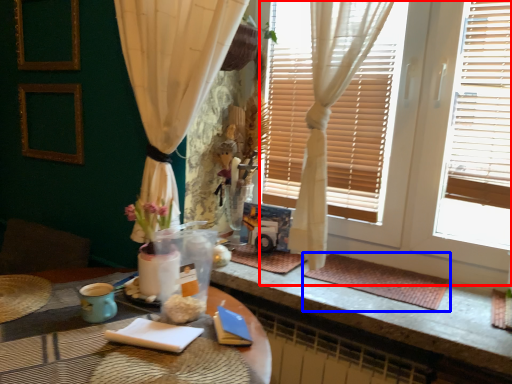
Question: Which object is closer to the camera taking this photo, window frame (highlighted by a red box) or wide (highlighted by a blue box)?

Choices:
 (A) window frame
 (B) wide

Answer: (A)